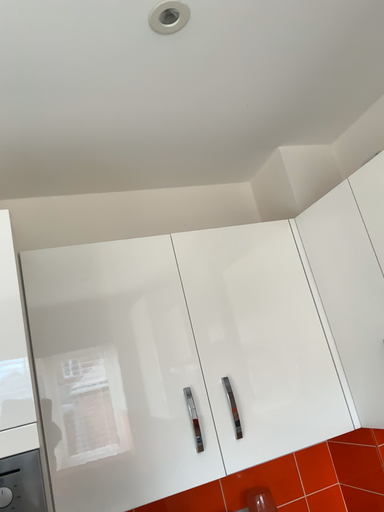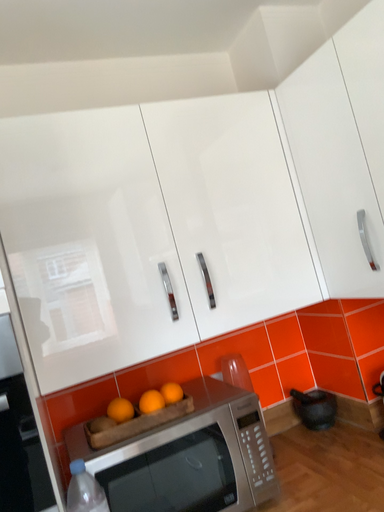
Question: Which way did the camera rotate in the video?

Choices:
 (A) rotated upward
 (B) rotated downward

Answer: (B)